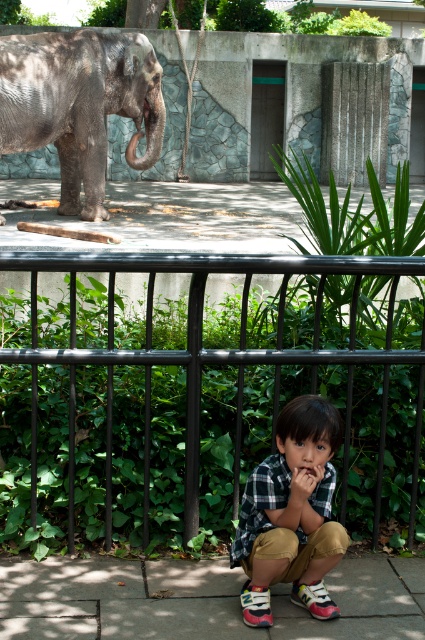
Measure the distance from black metal fence at center to pink matte lips at center.

A distance of 1.46 meters exists between black metal fence at center and pink matte lips at center.

Between black metal fence at center and pink matte lips at center, which one is positioned lower?

pink matte lips at center is lower down.

Image resolution: width=425 pixels, height=640 pixels. What do you see at coordinates (203, 396) in the screenshot?
I see `black metal fence at center` at bounding box center [203, 396].

This screenshot has height=640, width=425. Find the location of `black metal fence at center`. black metal fence at center is located at coordinates (203, 396).

Can you confirm if gray textured elephant at upper left is positioned to the right of pink matte lips at center?

In fact, gray textured elephant at upper left is to the left of pink matte lips at center.

Who is positioned more to the left, gray textured elephant at upper left or pink matte lips at center?

gray textured elephant at upper left is more to the left.

Identify the location of gray textured elephant at upper left. The image size is (425, 640). (79, 104).

Does gray textured elephant at upper left appear on the right side of plaid fabric shirt at center?

Incorrect, gray textured elephant at upper left is not on the right side of plaid fabric shirt at center.

Is point (28, 140) less distant than point (274, 554)?

No, (28, 140) is further to viewer.

Identify the location of gray textured elephant at upper left. (79, 104).